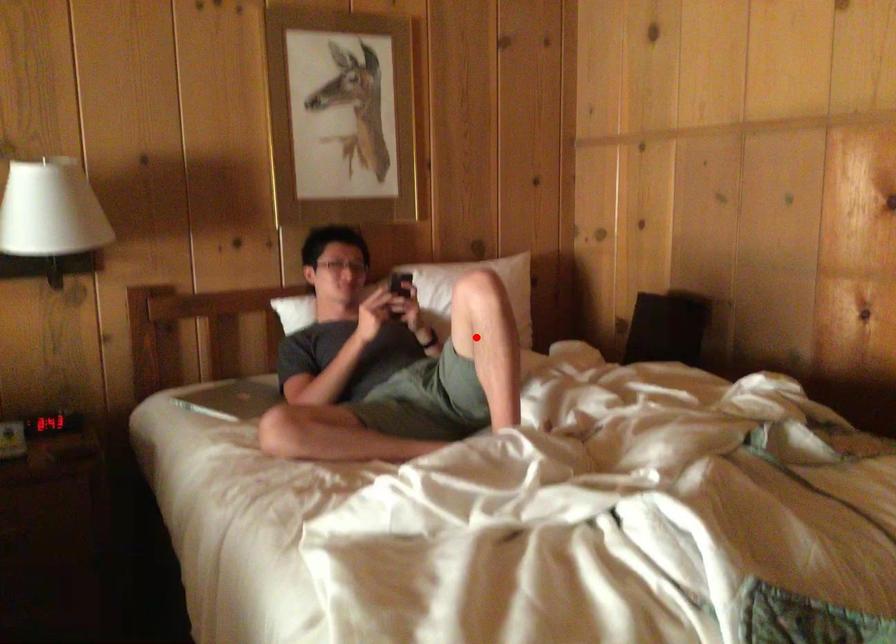
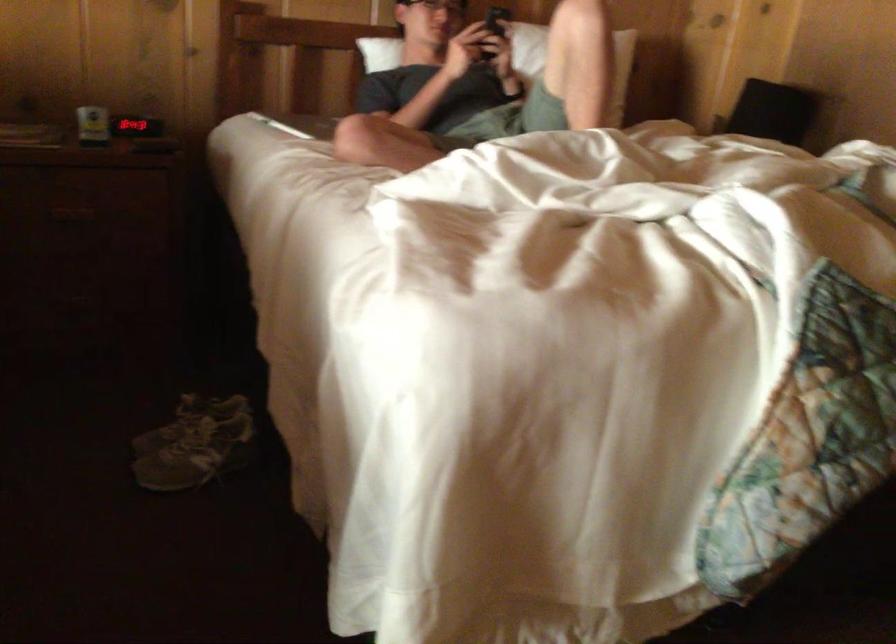
Where in the second image is the point corresponding to the highlighted location from the first image?

(573, 61)